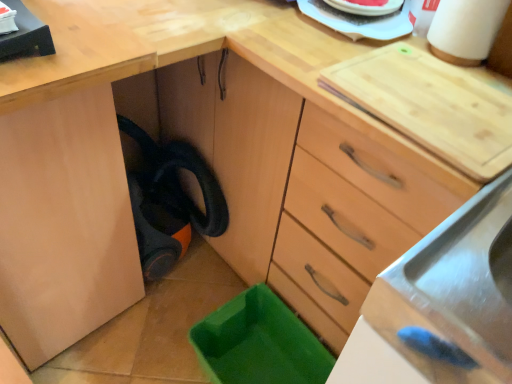
This screenshot has width=512, height=384. Describe the element at coordinates (455, 289) in the screenshot. I see `stainless steel sink at lower right` at that location.

Find the location of `stainless steel sink at lower right`. stainless steel sink at lower right is located at coordinates (455, 289).

Image resolution: width=512 pixels, height=384 pixels. Identify the location of white matte paper towel at upper right. (465, 30).

Image resolution: width=512 pixels, height=384 pixels. What do you see at coordinates (465, 30) in the screenshot?
I see `white matte paper towel at upper right` at bounding box center [465, 30].

Locate an element on the screen. Image resolution: width=512 pixels, height=384 pixels. stainless steel sink at lower right is located at coordinates (455, 289).

Is stainless steel sink at lower right to the left or to the right of white matte paper towel at upper right in the image?

Based on their positions, stainless steel sink at lower right is located to the left of white matte paper towel at upper right.

Is stainless steel sink at lower right behind white matte paper towel at upper right?

No, stainless steel sink at lower right is in front of white matte paper towel at upper right.

Considering the positions of points (378, 292) and (435, 24), is point (378, 292) closer to camera compared to point (435, 24)?

No, (378, 292) is further to viewer.

Consider the image. From the image's perspective, between stainless steel sink at lower right and white matte paper towel at upper right, which one is located above?

From the image's view, white matte paper towel at upper right is above.

From a real-world perspective, between stainless steel sink at lower right and white matte paper towel at upper right, who is vertically lower?

stainless steel sink at lower right, from a real-world perspective.

Can you confirm if stainless steel sink at lower right is wider than white matte paper towel at upper right?

Correct, the width of stainless steel sink at lower right exceeds that of white matte paper towel at upper right.

Considering the sizes of stainless steel sink at lower right and white matte paper towel at upper right in the image, is stainless steel sink at lower right taller or shorter than white matte paper towel at upper right?

stainless steel sink at lower right is shorter than white matte paper towel at upper right.

Is stainless steel sink at lower right smaller than white matte paper towel at upper right?

Incorrect, stainless steel sink at lower right is not smaller in size than white matte paper towel at upper right.

Does stainless steel sink at lower right contain white matte paper towel at upper right?

No, stainless steel sink at lower right does not contain white matte paper towel at upper right.

Is stainless steel sink at lower right not close to white matte paper towel at upper right?

stainless steel sink at lower right is actually quite close to white matte paper towel at upper right.

Is stainless steel sink at lower right aimed at white matte paper towel at upper right?

No, stainless steel sink at lower right does not turn towards white matte paper towel at upper right.

How many degrees apart are the facing directions of stainless steel sink at lower right and white matte paper towel at upper right?

The angular difference between stainless steel sink at lower right and white matte paper towel at upper right is 3.68 degrees.

Where is `paper towel on the right side of stainless steel sink at lower right`? paper towel on the right side of stainless steel sink at lower right is located at coordinates (x=465, y=30).

Considering the relative positions of white matte paper towel at upper right and stainless steel sink at lower right in the image provided, is white matte paper towel at upper right to the left or to the right of stainless steel sink at lower right?

white matte paper towel at upper right is to the right of stainless steel sink at lower right.

Is white matte paper towel at upper right positioned in front of stainless steel sink at lower right?

No, white matte paper towel at upper right is further to the viewer.

Is point (432, 37) closer or farther from the camera than point (473, 210)?

Point (432, 37) is farther from the camera than point (473, 210).

From the image's perspective, does white matte paper towel at upper right appear higher than stainless steel sink at lower right?

Yes, from the image's perspective, white matte paper towel at upper right is on top of stainless steel sink at lower right.

From a real-world perspective, is white matte paper towel at upper right located higher than stainless steel sink at lower right?

Yes, from a real-world perspective, white matte paper towel at upper right is over stainless steel sink at lower right

Considering the relative sizes of white matte paper towel at upper right and stainless steel sink at lower right in the image provided, is white matte paper towel at upper right wider than stainless steel sink at lower right?

No.

Is white matte paper towel at upper right shorter than stainless steel sink at lower right?

No.

Who is bigger, white matte paper towel at upper right or stainless steel sink at lower right?

stainless steel sink at lower right.

Can stainless steel sink at lower right be found inside white matte paper towel at upper right?

No.

Can you see white matte paper towel at upper right touching stainless steel sink at lower right?

No, white matte paper towel at upper right is not beside stainless steel sink at lower right.

Based on the photo, does white matte paper towel at upper right turn towards stainless steel sink at lower right?

No, white matte paper towel at upper right is not facing towards stainless steel sink at lower right.

Locate an element on the screen. This screenshot has height=384, width=512. paper towel to the right of stainless steel sink at lower right is located at coordinates (465, 30).

I want to click on sink on the left of white matte paper towel at upper right, so click(x=455, y=289).

At what (x,y) coordinates should I click in order to perform the action: click on paper towel above the stainless steel sink at lower right (from the image's perspective). Please return your answer as a coordinate pair (x, y). Looking at the image, I should click on (465, 30).